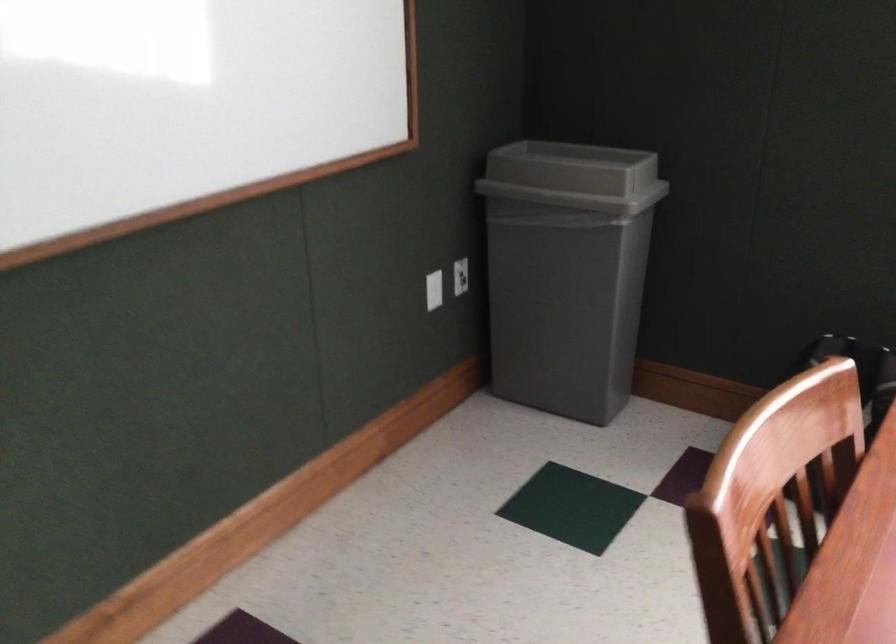
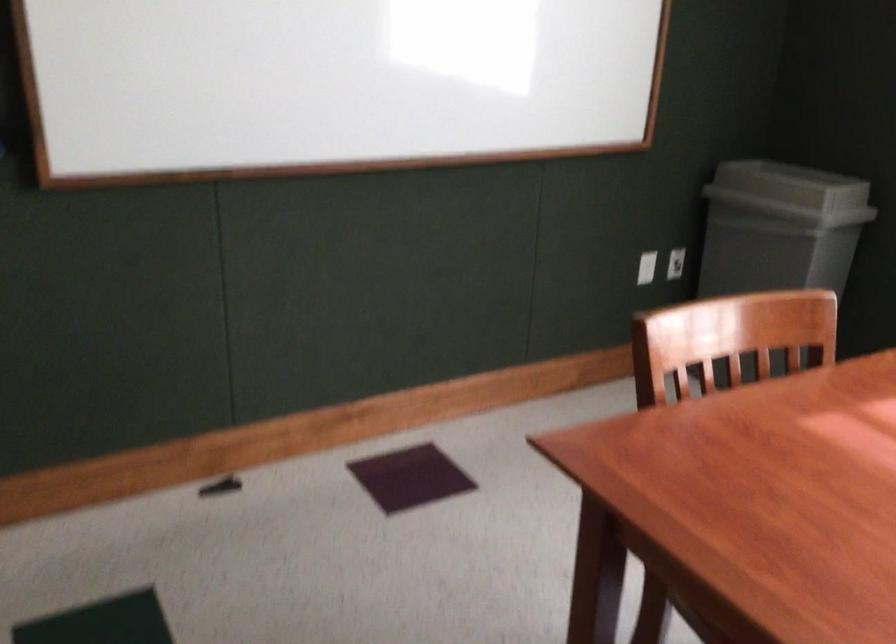
In the second image, find the point that corresponds to point (460, 283) in the first image.

(675, 263)